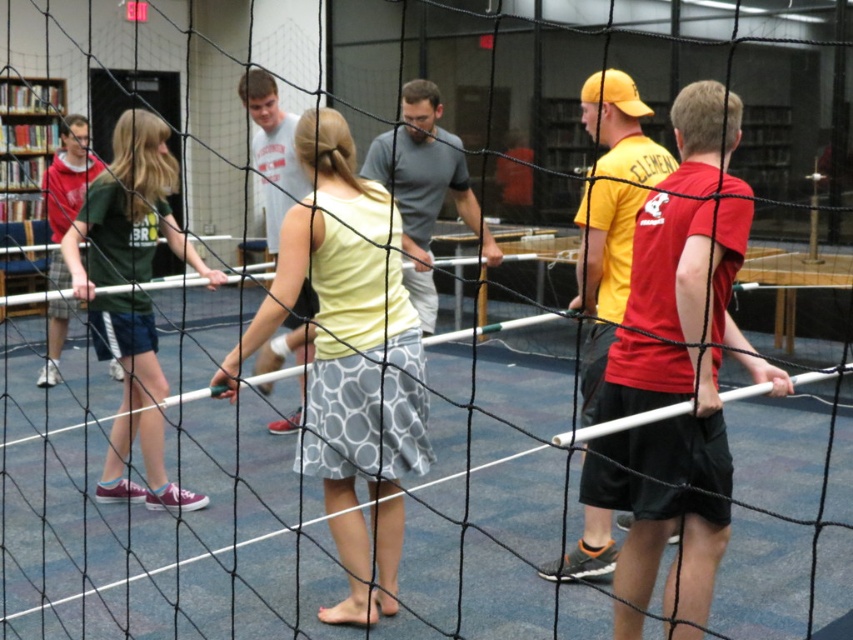
You are standing in the library and see the light yellow fabric shirt at center and the dark green jersey at left. Which clothing item is positioned more to the right side of the scene?

The light yellow fabric shirt at center is positioned more to the right side of the scene compared to the dark green jersey at left.

You are organizing a team photo and want to ensure all participants are visible. Given the light yellow fabric shirt at center and the dark green jersey at left, which clothing item should you position closer to the camera to ensure visibility?

The light yellow fabric shirt at center should be positioned closer to the camera because it occupies less space than the dark green jersey at left, making it easier to ensure visibility.

You are standing outside the library looking through the black netting structure. You see two people participating in the team activity. One is wearing a light yellow fabric shirt at center and another wearing a dark green jersey at left. Which participant is positioned closer to the ground?

The light yellow fabric shirt at center is below dark green jersey at left, so the participant wearing the light yellow fabric shirt at center is closer to the ground.